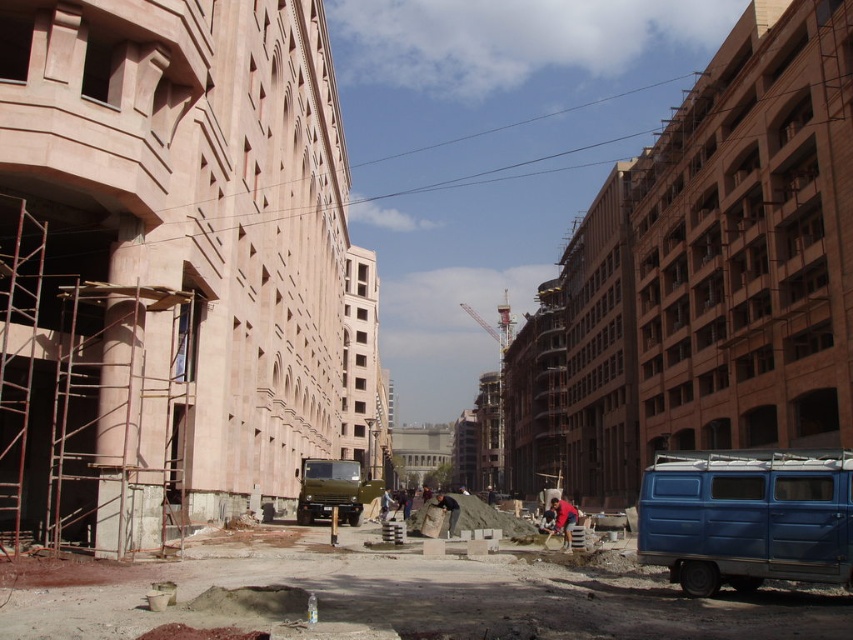
Question: Among these points, which one is nearest to the camera?

Choices:
 (A) tap(569, 536)
 (B) tap(683, 496)

Answer: (B)

Question: From the image, what is the correct spatial relationship of blue matte van at lower right in relation to red shirt at center?

Choices:
 (A) left
 (B) right

Answer: (B)

Question: Is blue matte van at lower right positioned in front of red shirt at center?

Choices:
 (A) no
 (B) yes

Answer: (B)

Question: Observing the image, what is the correct spatial positioning of blue matte van at lower right in reference to red shirt at center?

Choices:
 (A) left
 (B) right

Answer: (B)